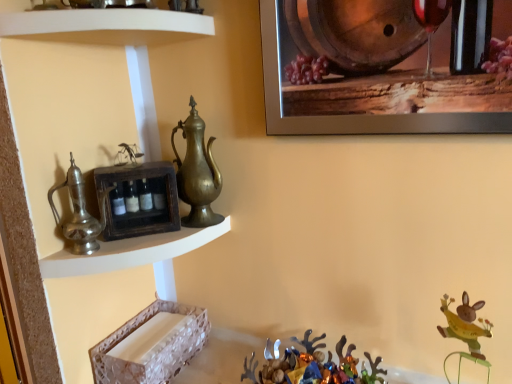
Where is `vacant region above white textured tray at lower left, the 1th shelf positioned from the bottom (from a real-world perspective)`? vacant region above white textured tray at lower left, the 1th shelf positioned from the bottom (from a real-world perspective) is located at coordinates (148, 330).